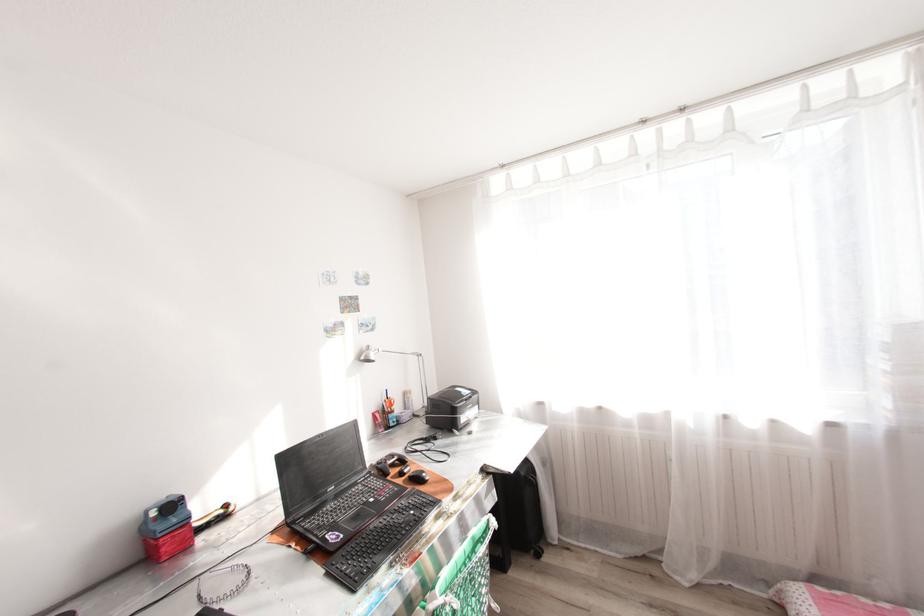
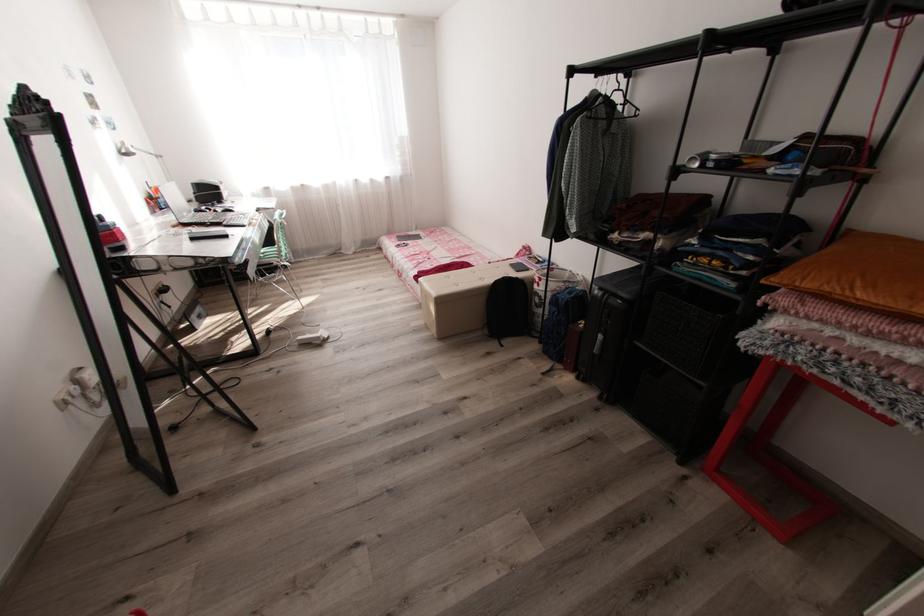
Where in the second image is the point corresponding to (x=367, y=358) from the first image?

(129, 151)